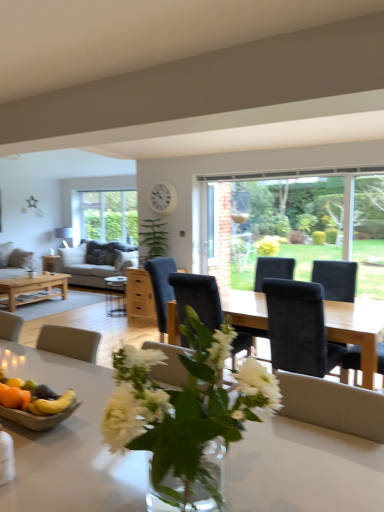
Question: Does suede black chair at center have a greater width compared to white glossy table at center?

Choices:
 (A) yes
 (B) no

Answer: (A)

Question: Is suede black chair at center at the left side of white glossy table at center?

Choices:
 (A) no
 (B) yes

Answer: (A)

Question: Is suede black chair at center thinner than white glossy table at center?

Choices:
 (A) yes
 (B) no

Answer: (B)

Question: Is suede black chair at center outside white glossy table at center?

Choices:
 (A) yes
 (B) no

Answer: (A)

Question: Does suede black chair at center come behind white glossy table at center?

Choices:
 (A) yes
 (B) no

Answer: (A)

Question: Would you say suede black chair at center is a long distance from white glossy table at center?

Choices:
 (A) no
 (B) yes

Answer: (B)

Question: Considering the relative sizes of matte gray fabric couch at left, which ranks as the 2th studio couch in right-to-left order, and matte wooden coffee table at center, the second coffee table positioned from the back, in the image provided, is matte gray fabric couch at left, which ranks as the 2th studio couch in right-to-left order, taller than matte wooden coffee table at center, the second coffee table positioned from the back,?

Choices:
 (A) no
 (B) yes

Answer: (B)

Question: Can we say matte gray fabric couch at left, which is counted as the first studio couch, starting from the left, lies outside matte wooden coffee table at center, placed as the 1th coffee table when sorted from right to left?

Choices:
 (A) no
 (B) yes

Answer: (B)

Question: Does matte gray fabric couch at left, which ranks as the 2th studio couch in right-to-left order, appear on the left side of matte wooden coffee table at center, placed as the 1th coffee table when sorted from right to left?

Choices:
 (A) yes
 (B) no

Answer: (A)

Question: Would you consider matte gray fabric couch at left, which ranks as the 2th studio couch in right-to-left order, to be distant from matte wooden coffee table at center, placed as the 1th coffee table when sorted from right to left?

Choices:
 (A) no
 (B) yes

Answer: (B)

Question: From the image's perspective, is matte gray fabric couch at left, which is counted as the first studio couch, starting from the left, beneath matte wooden coffee table at center, positioned as the 2th coffee table in left-to-right order?

Choices:
 (A) yes
 (B) no

Answer: (B)

Question: Can you confirm if matte gray fabric couch at left, which is counted as the first studio couch, starting from the left, is smaller than matte wooden coffee table at center, placed as the 1th coffee table when sorted from right to left?

Choices:
 (A) yes
 (B) no

Answer: (B)

Question: From a real-world perspective, does white glossy table at center stand above suede black chair at center?

Choices:
 (A) yes
 (B) no

Answer: (A)